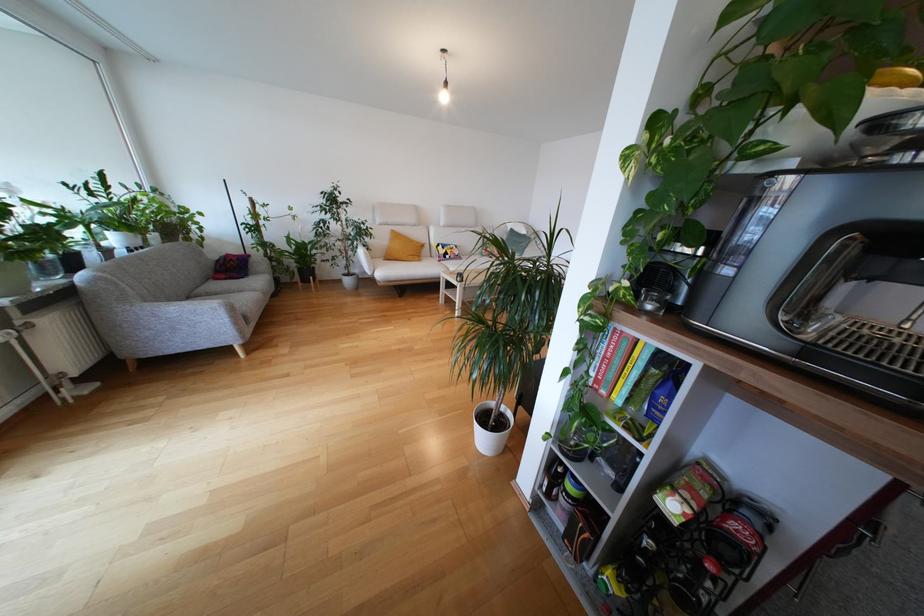
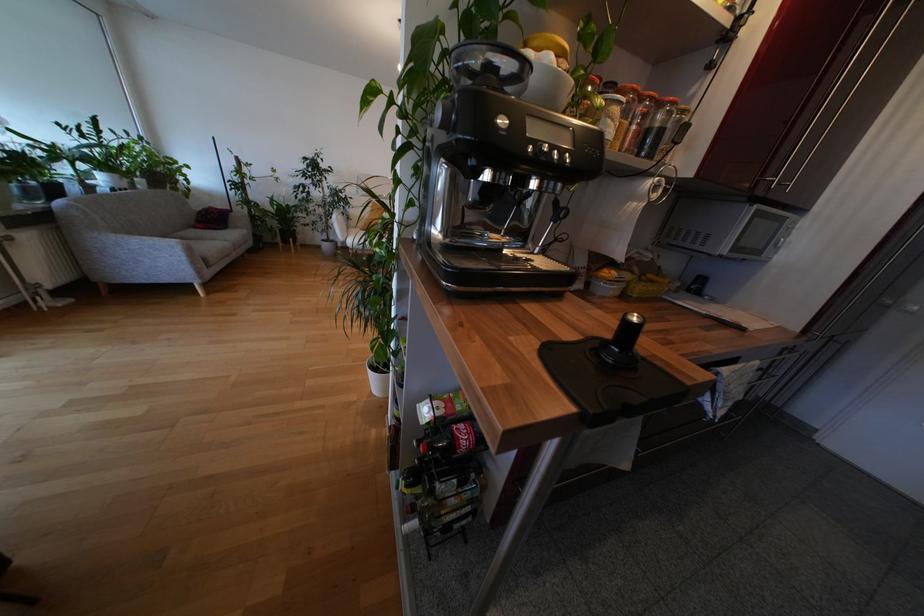
Locate, in the second image, the point that corresponds to (x=220, y=282) in the first image.

(200, 230)